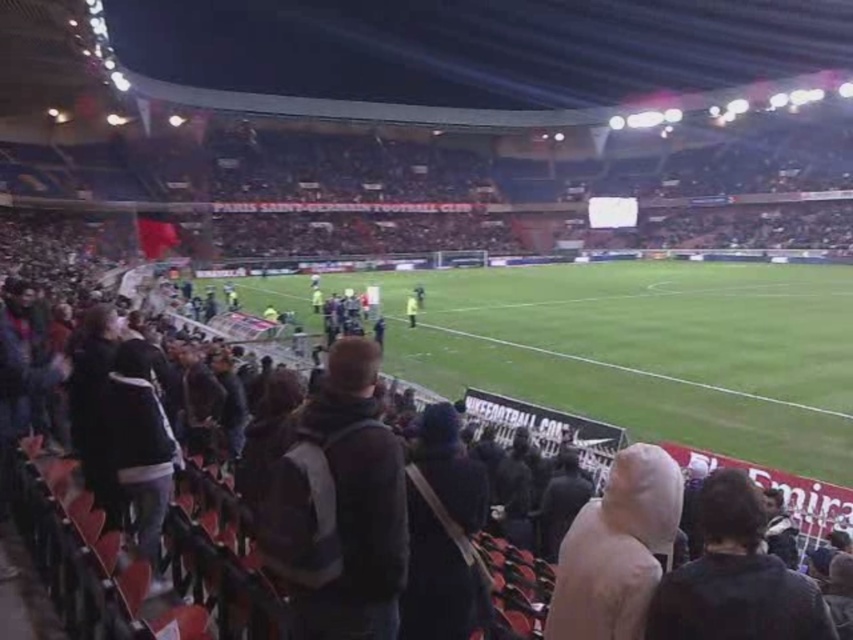
Does point (378, 477) come closer to viewer compared to point (733, 528)?

That is False.

Does dark gray backpack at center have a smaller size compared to dark brown leather jacket at center?

No, dark gray backpack at center is not smaller than dark brown leather jacket at center.

What do you see at coordinates (340, 508) in the screenshot?
I see `dark gray backpack at center` at bounding box center [340, 508].

Find the location of a particular element. dark gray backpack at center is located at coordinates (340, 508).

Is point (532, 294) closer to viewer compared to point (577, 579)?

No, it is not.

Is point (672, 422) positioned in front of point (660, 540)?

No, (672, 422) is behind (660, 540).

The image size is (853, 640). I want to click on green grass football field at center, so click(648, 349).

Where is `green grass football field at center`? green grass football field at center is located at coordinates (648, 349).

Can you confirm if green grass football field at center is positioned to the right of dark brown leather jacket at center?

No, green grass football field at center is not to the right of dark brown leather jacket at center.

Does point (509, 353) come farther from viewer compared to point (744, 540)?

Yes, point (509, 353) is behind point (744, 540).

Identify the location of green grass football field at center. This screenshot has width=853, height=640. (648, 349).